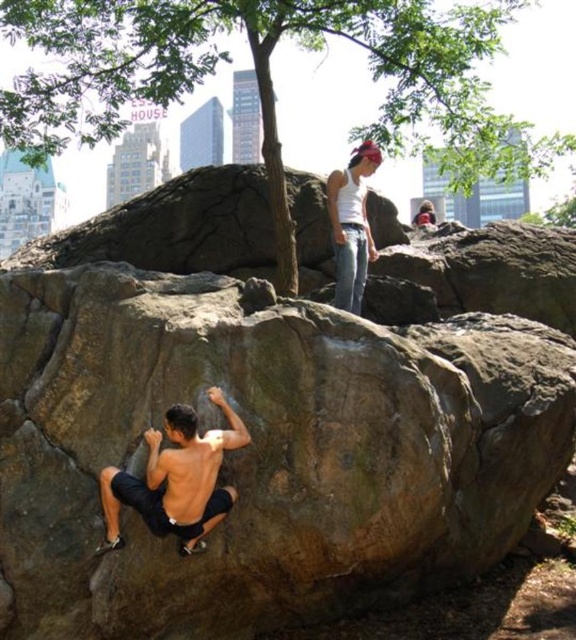
Is green leafy tree at upper center to the right of shiny black shorts at lower left from the viewer's perspective?

Indeed, green leafy tree at upper center is positioned on the right side of shiny black shorts at lower left.

Is green leafy tree at upper center wider than shiny black shorts at lower left?

Yes.

Find the location of `green leafy tree at upper center`. green leafy tree at upper center is located at coordinates (271, 77).